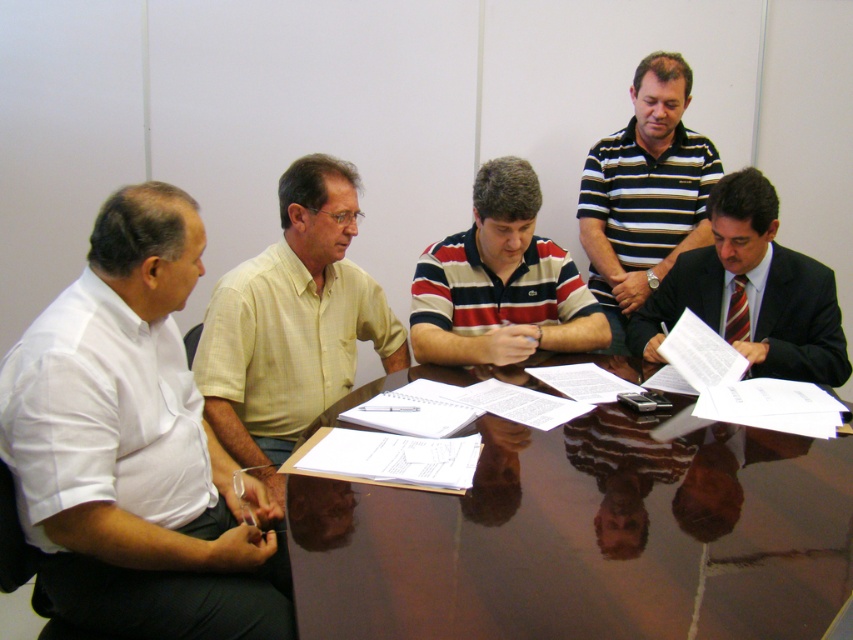
You are a photographer standing behind the camera aiming to capture the group of men around the table. You want to ensure both the white shirt at left and the dark suit at lower right are clearly visible in the frame. Which one is closer to the camera, and therefore more in focus?

The white shirt at left is positioned under dark suit at lower right, meaning it is closer to the camera. Therefore, the white shirt at left will be more in focus.

You are a photographer positioned behind the group. You need to take a photo that clearly shows both the white shirt at left and the dark suit at lower right. Which person should you focus on to ensure both are in sharp focus?

You should focus on the white shirt at left because it is closer to the viewer than the dark suit at lower right, so focusing on the closer subject will keep both in focus due to the depth of field.